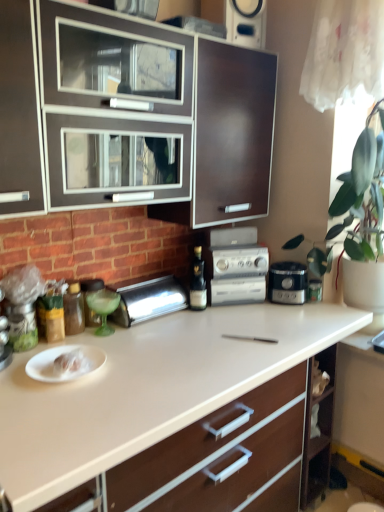
This screenshot has width=384, height=512. In order to click on black glass bottle at center, which is the first bottle in right-to-left order in this screenshot , I will do `click(198, 282)`.

Measure the distance between white paper plate at lower left and camera.

white paper plate at lower left and camera are 1.27 meters apart.

This screenshot has height=512, width=384. Find the location of `satin black coffee maker at center`. satin black coffee maker at center is located at coordinates (287, 283).

Describe the element at coordinates (235, 266) in the screenshot. Image resolution: width=384 pixels, height=512 pixels. I see `silver metallic stereo at center` at that location.

At what (x,y) coordinates should I click in order to perform the action: click on silver metallic breadbox at left, acting as the 2th appliance starting from the front. Please return your answer as a coordinate pair (x, y). This screenshot has height=512, width=384. Looking at the image, I should click on (149, 300).

What do you see at coordinates (74, 309) in the screenshot? I see `brown glass bottle at left, the first bottle in the left-to-right sequence` at bounding box center [74, 309].

This screenshot has height=512, width=384. In order to click on black glass bottle at center, which is the first bottle in right-to-left order in this screenshot , I will do `click(198, 282)`.

Could you tell me if silver metallic stereo at center is facing black glass bottle at center, which is the first bottle from back to front?

No, silver metallic stereo at center does not turn towards black glass bottle at center, which is the first bottle from back to front.

Relative to black glass bottle at center, which is the first bottle in right-to-left order, is silver metallic stereo at center in front or behind?

Visually, silver metallic stereo at center is located behind black glass bottle at center, which is the first bottle in right-to-left order.

From their relative heights in the image, would you say silver metallic stereo at center is taller or shorter than black glass bottle at center, which is the first bottle in right-to-left order?

silver metallic stereo at center is taller than black glass bottle at center, which is the first bottle in right-to-left order.

Would you say silver metallic stereo at center is outside black glass bottle at center, which ranks as the 2th bottle in left-to-right order?

silver metallic stereo at center lies outside black glass bottle at center, which ranks as the 2th bottle in left-to-right order,'s area.

Can we say white glossy countertop at center lies outside silver metallic breadbox at left, which ranks as the second appliance in left-to-right order?

white glossy countertop at center lies outside silver metallic breadbox at left, which ranks as the second appliance in left-to-right order,'s area.

Considering the sizes of objects white glossy countertop at center and silver metallic breadbox at left, acting as the 2th appliance starting from the front, in the image provided, who is smaller, white glossy countertop at center or silver metallic breadbox at left, acting as the 2th appliance starting from the front,?

silver metallic breadbox at left, acting as the 2th appliance starting from the front.

Between white glossy countertop at center and silver metallic breadbox at left, which ranks as the second appliance in left-to-right order, which one has more height?

white glossy countertop at center is taller.

Is brown glass bottle at left, the first bottle in the left-to-right sequence, oriented towards white paper plate at lower left?

No, brown glass bottle at left, the first bottle in the left-to-right sequence, is not turned towards white paper plate at lower left.

Is brown glass bottle at left, placed as the second bottle when sorted from back to front, inside the boundaries of white paper plate at lower left, or outside?

brown glass bottle at left, placed as the second bottle when sorted from back to front, is spatially situated outside white paper plate at lower left.

Locate an element on the screen. The width and height of the screenshot is (384, 512). bottle that is the 1st one when counting backward from the white paper plate at lower left is located at coordinates (74, 309).

Is silver metallic stereo at center turned away from metallic silver spice container at left, which ranks as the second appliance in right-to-left order?

No, silver metallic stereo at center is not facing the opposite direction of metallic silver spice container at left, which ranks as the second appliance in right-to-left order.

Is silver metallic stereo at center with metallic silver spice container at left, the 1th appliance when ordered from front to back?

silver metallic stereo at center and metallic silver spice container at left, the 1th appliance when ordered from front to back, are not in contact.

Does point (221, 300) appear closer or farther from the camera than point (26, 320)?

Point (221, 300) appears to be farther away from the viewer than point (26, 320).

Considering the sizes of silver metallic stereo at center and metallic silver spice container at left, the 1th appliance when ordered from front to back, in the image, is silver metallic stereo at center wider or thinner than metallic silver spice container at left, the 1th appliance when ordered from front to back,?

Clearly, silver metallic stereo at center has more width compared to metallic silver spice container at left, the 1th appliance when ordered from front to back.

Would you say silver metallic stereo at center is outside silver metallic breadbox at left, which ranks as the 1th appliance in right-to-left order?

Absolutely, silver metallic stereo at center is external to silver metallic breadbox at left, which ranks as the 1th appliance in right-to-left order.

Between point (205, 249) and point (146, 314), which one is positioned behind?

The point (205, 249) is farther from the camera.

In terms of width, does silver metallic stereo at center look wider or thinner when compared to silver metallic breadbox at left, which ranks as the 1th appliance in right-to-left order?

In the image, silver metallic stereo at center appears to be wider than silver metallic breadbox at left, which ranks as the 1th appliance in right-to-left order.

At what (x,y) coordinates should I click in order to perform the action: click on kitchen appliance behind the silver metallic breadbox at left, which ranks as the 1th appliance in right-to-left order. Please return your answer as a coordinate pair (x, y). Looking at the image, I should click on (235, 266).

How distant is satin black coffee maker at center from metallic silver spice container at left, the 2th appliance viewed from the back?

A distance of 1.06 meters exists between satin black coffee maker at center and metallic silver spice container at left, the 2th appliance viewed from the back.

Which object is positioned more to the left, satin black coffee maker at center or metallic silver spice container at left, the 2th appliance viewed from the back?

metallic silver spice container at left, the 2th appliance viewed from the back.

Is metallic silver spice container at left, arranged as the 1th appliance when viewed from the left, at the back of satin black coffee maker at center?

No, satin black coffee maker at center's orientation is not away from metallic silver spice container at left, arranged as the 1th appliance when viewed from the left.

Considering the sizes of objects satin black coffee maker at center and metallic silver spice container at left, which ranks as the second appliance in right-to-left order, in the image provided, who is taller, satin black coffee maker at center or metallic silver spice container at left, which ranks as the second appliance in right-to-left order,?

Standing taller between the two is satin black coffee maker at center.

In the scene shown: Between matte brown cabinet at upper center and black glass bottle at center, the second bottle in the front-to-back sequence, which one has larger size?

matte brown cabinet at upper center is bigger.

Is matte brown cabinet at upper center aimed at black glass bottle at center, the second bottle in the front-to-back sequence?

No, matte brown cabinet at upper center is not aimed at black glass bottle at center, the second bottle in the front-to-back sequence.

In the scene shown: Which object is wider, matte brown cabinet at upper center or black glass bottle at center, which is the first bottle from back to front?

Wider between the two is matte brown cabinet at upper center.

Relative to black glass bottle at center, which is the first bottle in right-to-left order, is matte brown cabinet at upper center in front or behind?

matte brown cabinet at upper center is in front of black glass bottle at center, which is the first bottle in right-to-left order.

Locate an element on the screen. the 1st bottle counting from the left side of the silver metallic stereo at center is located at coordinates click(198, 282).

Find the location of a particular element. Image resolution: width=384 pixels, height=512 pixels. countertop located in front of the silver metallic breadbox at left, which ranks as the second appliance in left-to-right order is located at coordinates (148, 389).

When comparing their distances from white paper plate at lower left, does metallic silver spice container at left, which ranks as the second appliance in right-to-left order, or satin black coffee maker at center seem closer?

The object closer to white paper plate at lower left is metallic silver spice container at left, which ranks as the second appliance in right-to-left order.

From the image, which object appears to be nearer to satin black coffee maker at center, silver metallic stereo at center or black glass bottle at center, which is the first bottle in right-to-left order?

The object closer to satin black coffee maker at center is silver metallic stereo at center.

Based on their spatial positions, is silver metallic stereo at center or metallic silver spice container at left, the 1th appliance when ordered from front to back, further from white glossy countertop at center?

metallic silver spice container at left, the 1th appliance when ordered from front to back, is further to white glossy countertop at center.

When comparing their distances from silver metallic breadbox at left, acting as the 2th appliance starting from the front, does silver metallic stereo at center or brown glass bottle at left, the first bottle in the left-to-right sequence, seem further?

silver metallic stereo at center lies further to silver metallic breadbox at left, acting as the 2th appliance starting from the front, than the other object.

Which object lies further to the anchor point black glass bottle at center, which is the first bottle from back to front, metallic silver spice container at left, which ranks as the second appliance in right-to-left order, or brown glass bottle at left, placed as the second bottle when sorted from back to front?

metallic silver spice container at left, which ranks as the second appliance in right-to-left order, is positioned further to the anchor black glass bottle at center, which is the first bottle from back to front.

Based on their spatial positions, is silver metallic breadbox at left, the first appliance in the back-to-front sequence, or white paper plate at lower left closer to brown glass bottle at left, placed as the 2th bottle when sorted from right to left?

The object closer to brown glass bottle at left, placed as the 2th bottle when sorted from right to left, is silver metallic breadbox at left, the first appliance in the back-to-front sequence.

From the image, which object appears to be farther from metallic silver spice container at left, the 1th appliance when ordered from front to back, white paper plate at lower left or matte brown cabinet at upper center?

matte brown cabinet at upper center.

Which object lies nearer to the anchor point black glass bottle at center, which is the first bottle from back to front, silver metallic breadbox at left, acting as the 2th appliance starting from the front, or white glossy countertop at center?

Based on the image, silver metallic breadbox at left, acting as the 2th appliance starting from the front, appears to be nearer to black glass bottle at center, which is the first bottle from back to front.

This screenshot has height=512, width=384. I want to click on kitchen appliance between brown glass bottle at left, the first bottle in the left-to-right sequence, and satin black coffee maker at center, in the horizontal direction, so click(x=235, y=266).

Identify the location of paper plate between white glossy countertop at center and metallic silver spice container at left, arranged as the 1th appliance when viewed from the left, from front to back. The height and width of the screenshot is (512, 384). tap(64, 362).

You are a GUI agent. You are given a task and a screenshot of the screen. Output one action in this format:
    pyautogui.click(x=<x>, y=<y>)
    Task: Click on the appliance located between metallic silver spice container at left, which ranks as the second appliance in right-to-left order, and satin black coffee maker at center in the left-right direction
    
    Given the screenshot: What is the action you would take?
    pyautogui.click(x=149, y=300)

Identify the location of kitchen appliance situated between metallic silver spice container at left, which ranks as the second appliance in right-to-left order, and satin black coffee maker at center from left to right. (235, 266).